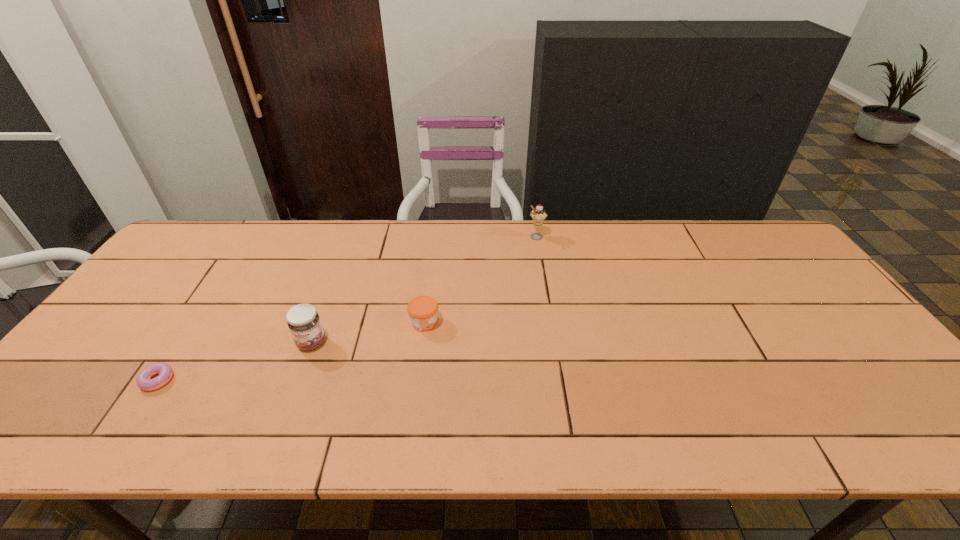
Image resolution: width=960 pixels, height=540 pixels. Find the location of `free space located on the front label of the shorter jam`. free space located on the front label of the shorter jam is located at coordinates (548, 323).

This screenshot has height=540, width=960. I want to click on vacant space located on the back of the doughnut, so click(208, 301).

Locate an element on the screen. This screenshot has height=540, width=960. object located in the far edge section of the desktop is located at coordinates (538, 215).

In the image, there is a desktop. Identify the location of free region at the far edge. This screenshot has width=960, height=540. (437, 228).

Image resolution: width=960 pixels, height=540 pixels. In the image, there is a desktop. Identify the location of vacant space at the near edge. (789, 430).

Where is `blank space at the left edge of the desktop`? The width and height of the screenshot is (960, 540). blank space at the left edge of the desktop is located at coordinates (119, 314).

In the image, there is a desktop. Identify the location of vacant space at the right edge. (793, 318).

At what (x,y) coordinates should I click in order to perform the action: click on blank area at the far left corner. Please return your answer as a coordinate pair (x, y). Looking at the image, I should click on (213, 250).

Where is `blank region between the tallest object and the leftmost object`? The height and width of the screenshot is (540, 960). blank region between the tallest object and the leftmost object is located at coordinates (347, 309).

Locate an element on the screen. vacant space that's between the right jam and the second object from left to right is located at coordinates (368, 333).